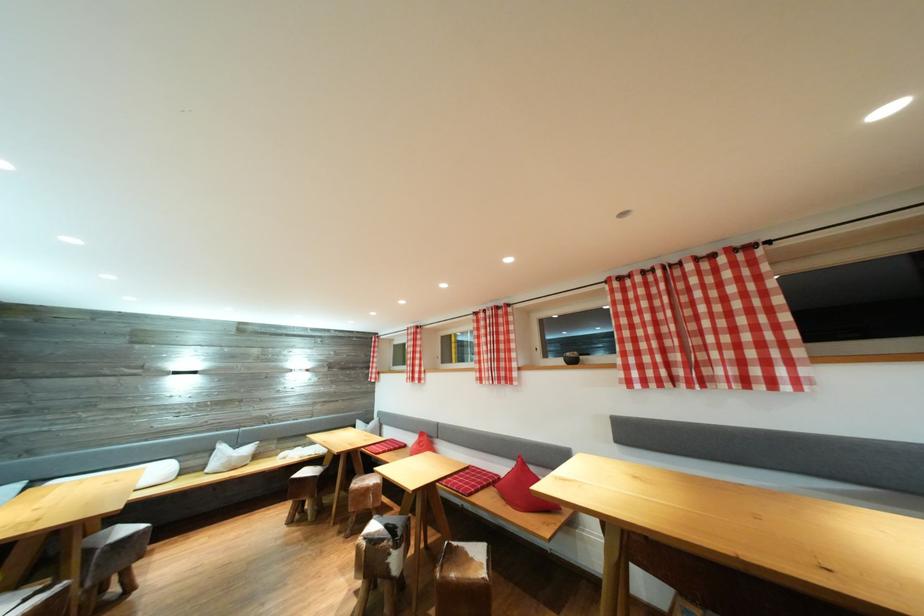
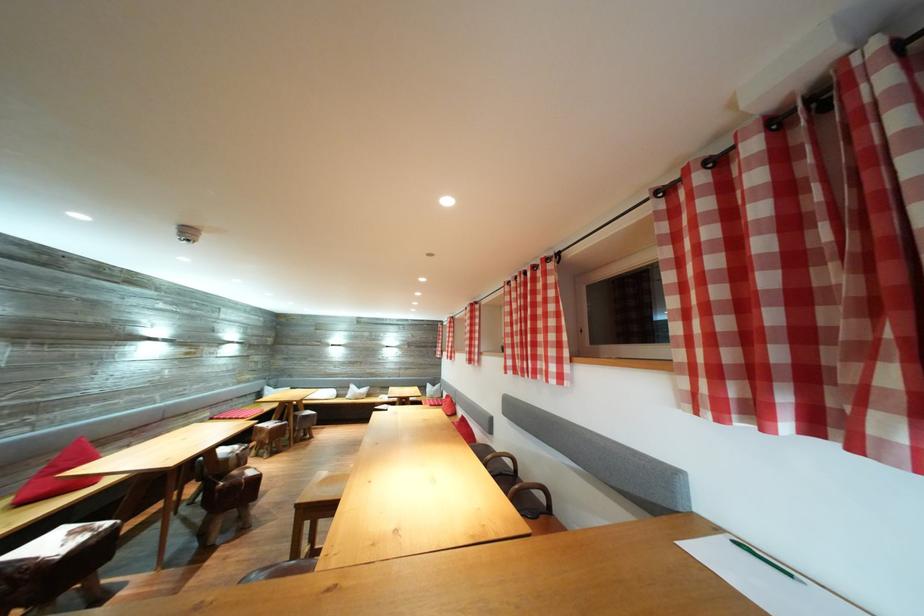
Where in the second image is the point corresponding to point 228,453 from the first image?

(359, 392)